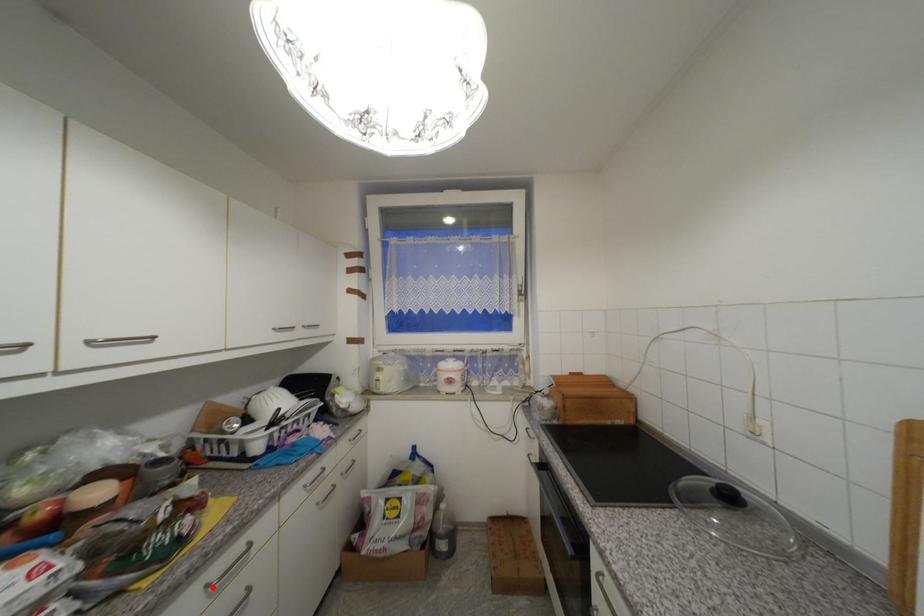
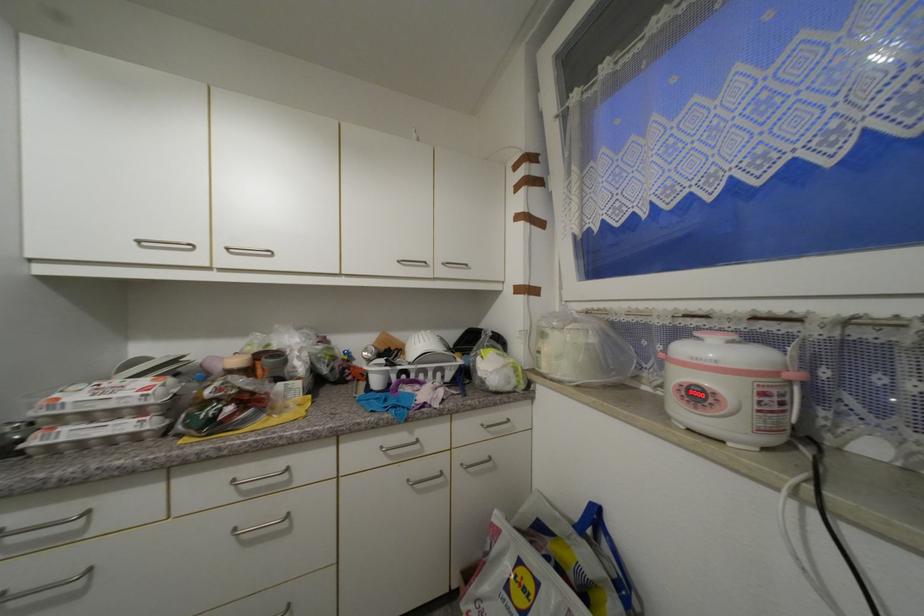
Locate, in the second image, the point that corresponds to the highlighted location in the first image.

(238, 483)